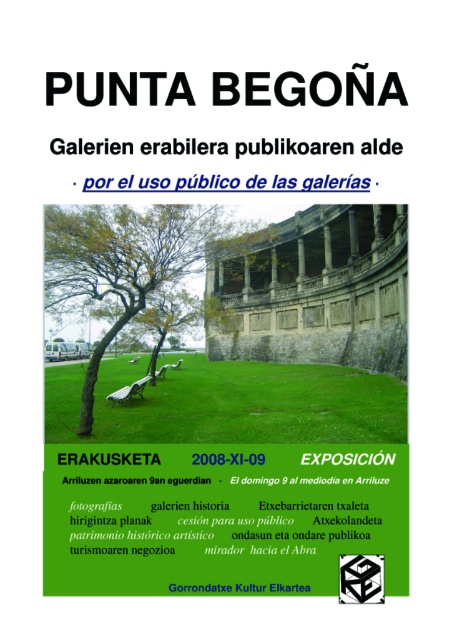
Can you confirm if green grass at center is shorter than green leafy tree at center?

Yes.

Identify the location of green grass at center. This screenshot has height=640, width=452. (230, 404).